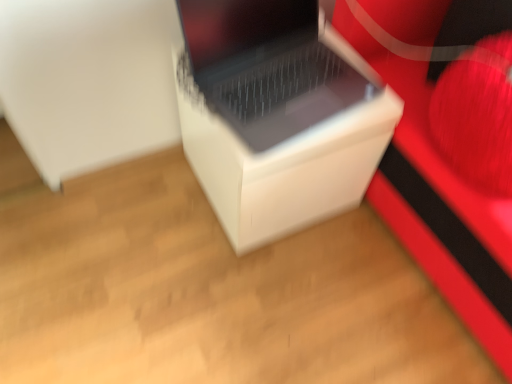
What are the coordinates of `matte white speaker at center` in the screenshot? It's located at (447, 147).

What is the approximate width of matte white speaker at center?

35.08 inches.

What is the approximate width of white matte cardboard box at center?

It is 16.47 inches.

This screenshot has width=512, height=384. I want to click on white plastic laptop at center, so click(x=266, y=67).

Measure the distance between matte white speaker at center and white plastic laptop at center.

A distance of 10.97 inches exists between matte white speaker at center and white plastic laptop at center.

Considering the positions of objects matte white speaker at center and white plastic laptop at center in the image provided, who is more to the left, matte white speaker at center or white plastic laptop at center?

white plastic laptop at center.

Does matte white speaker at center have a smaller size compared to white plastic laptop at center?

Actually, matte white speaker at center might be larger than white plastic laptop at center.

From a real-world perspective, relative to white plastic laptop at center, is matte white speaker at center vertically above or below?

matte white speaker at center is below white plastic laptop at center.

Is white matte cardboard box at center shorter than matte white speaker at center?

Yes.

Find the location of `cardboard box behind the matte white speaker at center`. cardboard box behind the matte white speaker at center is located at coordinates (282, 164).

Which object is more forward, white matte cardboard box at center or matte white speaker at center?

matte white speaker at center is closer to the camera.

Which object is positioned more to the right, white matte cardboard box at center or matte white speaker at center?

From the viewer's perspective, matte white speaker at center appears more on the right side.

Is matte white speaker at center beside white matte cardboard box at center?

No, matte white speaker at center is not next to white matte cardboard box at center.

Is matte white speaker at center looking in the opposite direction of white matte cardboard box at center?

No, matte white speaker at center's orientation is not away from white matte cardboard box at center.

Does matte white speaker at center appear on the left side of white matte cardboard box at center?

No, matte white speaker at center is not to the left of white matte cardboard box at center.

Is white plastic laptop at center smaller than matte white speaker at center?

Yes.

Based on the photo, how far apart are white plastic laptop at center and matte white speaker at center?

A distance of 10.97 inches exists between white plastic laptop at center and matte white speaker at center.

Find the location of a particular element. The image size is (512, 384). laptop to the left of matte white speaker at center is located at coordinates (266, 67).

Are white plastic laptop at center and white matte cardboard box at center located far from each other?

Actually, white plastic laptop at center and white matte cardboard box at center are a little close together.

Based on the photo, is white plastic laptop at center turned away from white matte cardboard box at center?

white plastic laptop at center is not turned away from white matte cardboard box at center.

Is white plastic laptop at center positioned beyond the bounds of white matte cardboard box at center?

Yes.

Between white matte cardboard box at center and white plastic laptop at center, which one has larger size?

Bigger between the two is white matte cardboard box at center.

Is white matte cardboard box at center positioned far away from white plastic laptop at center?

That's not correct — white matte cardboard box at center is a little close to white plastic laptop at center.

The width and height of the screenshot is (512, 384). Find the location of `cardboard box on the left side of white plastic laptop at center`. cardboard box on the left side of white plastic laptop at center is located at coordinates (282, 164).

Would you say white matte cardboard box at center is to the left or to the right of white plastic laptop at center in the picture?

white matte cardboard box at center is to the left of white plastic laptop at center.

What are the coordinates of `furniture on the right side of white plastic laptop at center` in the screenshot? It's located at (447, 147).

Identify the location of cardboard box behind the matte white speaker at center. (282, 164).

Based on their spatial positions, is matte white speaker at center or white plastic laptop at center further from white matte cardboard box at center?

matte white speaker at center lies further to white matte cardboard box at center than the other object.

When comparing their distances from matte white speaker at center, does white plastic laptop at center or white matte cardboard box at center seem further?

The object further to matte white speaker at center is white plastic laptop at center.

Looking at the image, which one is located closer to matte white speaker at center, white matte cardboard box at center or white plastic laptop at center?

white matte cardboard box at center is closer to matte white speaker at center.

Looking at the image, which one is located further to white plastic laptop at center, white matte cardboard box at center or matte white speaker at center?

matte white speaker at center is positioned further to the anchor white plastic laptop at center.

Looking at the image, which one is located closer to white plastic laptop at center, matte white speaker at center or white matte cardboard box at center?

Based on the image, white matte cardboard box at center appears to be nearer to white plastic laptop at center.

In the scene shown: Based on their spatial positions, is white plastic laptop at center or matte white speaker at center closer to white matte cardboard box at center?

white plastic laptop at center is positioned closer to the anchor white matte cardboard box at center.

Locate an element on the screen. laptop between white matte cardboard box at center and matte white speaker at center in the horizontal direction is located at coordinates (266, 67).